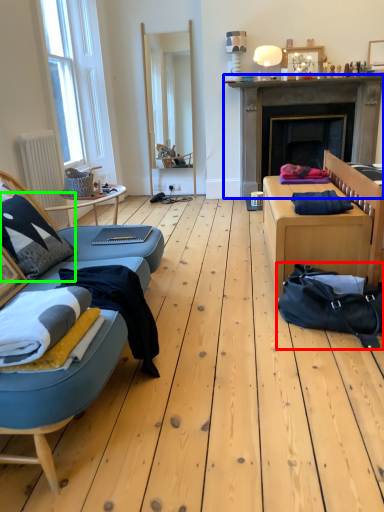
Question: Considering the real-world distances, which object is farthest from bag (highlighted by a red box)? fireplace (highlighted by a blue box) or pillow (highlighted by a green box)?

Choices:
 (A) fireplace
 (B) pillow

Answer: (A)